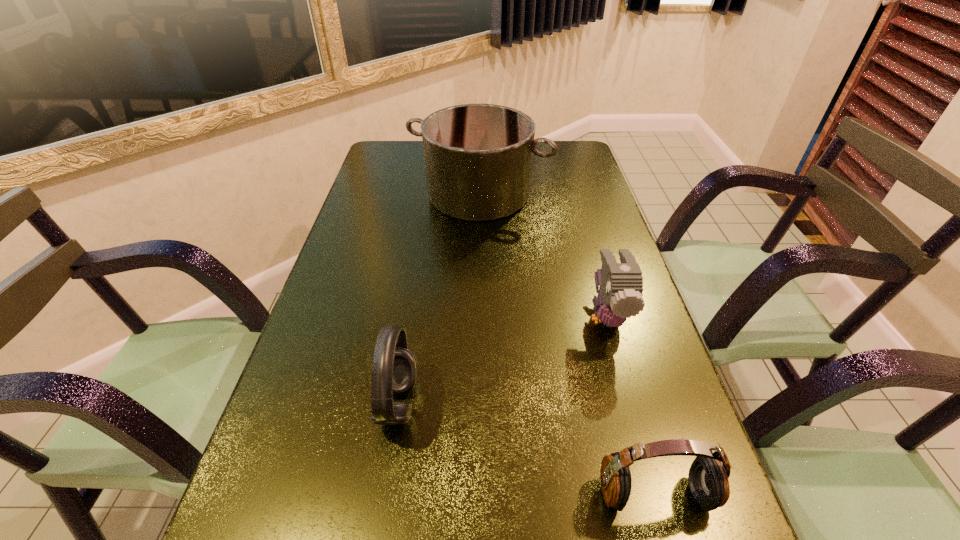
At what (x,y) coordinates should I click in order to perform the action: click on vacant area that lies between the left headset and the bird. Please return your answer as a coordinate pair (x, y). The height and width of the screenshot is (540, 960). Looking at the image, I should click on (502, 360).

What are the coordinates of `free space between the bird and the farther headset` in the screenshot? It's located at (502, 360).

This screenshot has width=960, height=540. Find the location of `unoccupied position between the farther headset and the nearer headset`. unoccupied position between the farther headset and the nearer headset is located at coordinates (526, 449).

The height and width of the screenshot is (540, 960). Identify the location of free spot between the third nearest object and the farther headset. (502, 360).

Find the location of `free space between the farther headset and the second farthest object`. free space between the farther headset and the second farthest object is located at coordinates (502, 360).

Image resolution: width=960 pixels, height=540 pixels. Identify the location of free space between the bird and the tallest object. (542, 255).

The image size is (960, 540). I want to click on free space between the left headset and the bird, so click(502, 360).

Locate an element on the screen. vacant region between the bird and the pan is located at coordinates (542, 255).

Identify which object is the second nearest to the third farthest object. Please provide its 2D coordinates. Your answer should be formatted as a tuple, i.e. [(x, y)], where the tuple contains the x and y coordinates of a point satisfying the conditions above.

[(619, 297)]

You are a GUI agent. You are given a task and a screenshot of the screen. Output one action in this format:
    pyautogui.click(x=<x>, y=<y>)
    Task: Click on the closest object to the right headset
    
    Given the screenshot: What is the action you would take?
    619,297